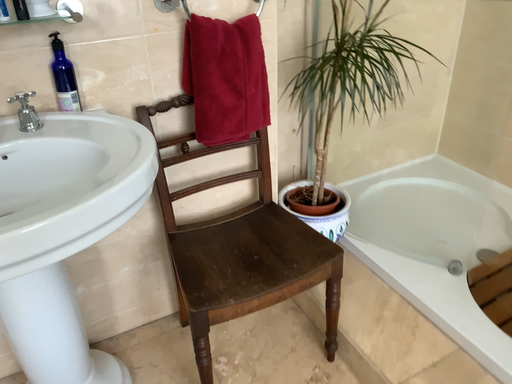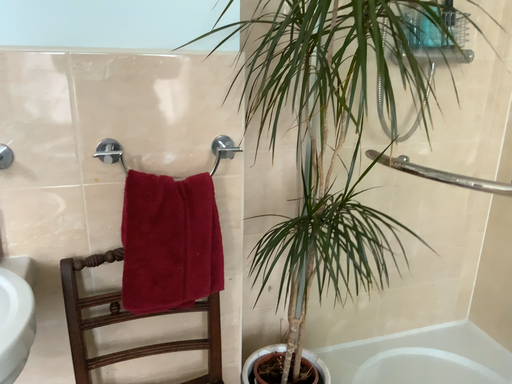
Question: How did the camera likely rotate when shooting the video?

Choices:
 (A) rotated downward
 (B) rotated upward

Answer: (B)